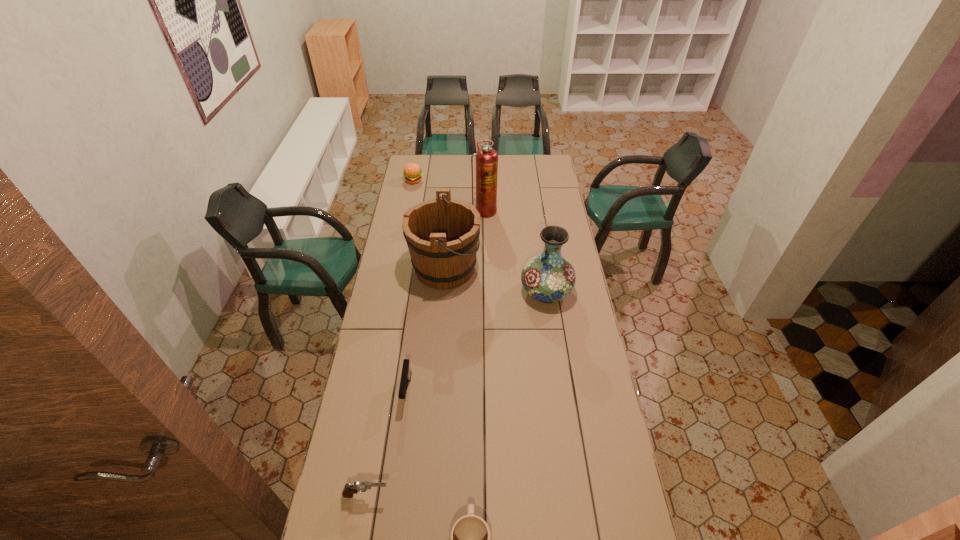
Locate an element on the screen. vacant space located 0.280m on the front of the hamburger is located at coordinates (407, 216).

This screenshot has height=540, width=960. I want to click on free space located on the front-facing side of the third nearest object, so click(393, 501).

This screenshot has height=540, width=960. I want to click on vacant space located at the barrel of the second nearest object, so click(x=420, y=495).

In order to click on wine bucket that is at the left edge in this screenshot , I will do `click(442, 234)`.

Identify the location of hamburger that is at the left edge. (412, 172).

Locate an element on the screen. This screenshot has height=540, width=960. pistol that is at the left edge is located at coordinates (349, 490).

You are a GUI agent. You are given a task and a screenshot of the screen. Output one action in this format:
    pyautogui.click(x=<x>, y=<y>)
    Task: Click on the object that is at the right edge
    The image size is (960, 540).
    Given the screenshot: What is the action you would take?
    pyautogui.click(x=549, y=277)

At what (x,y) coordinates should I click in order to perform the action: click on free region at the far edge. Please return your answer as a coordinate pair (x, y). Looking at the image, I should click on (474, 172).

Where is `free space at the left edge of the desktop`? The height and width of the screenshot is (540, 960). free space at the left edge of the desktop is located at coordinates (398, 222).

Identify the location of vacant point at the right edge. This screenshot has width=960, height=540. (551, 204).